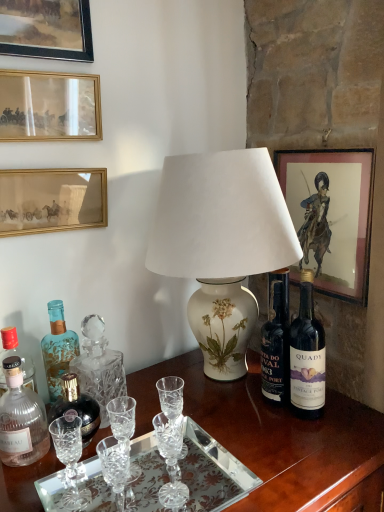
Where is `vacant space in clear glass tray at lower center (from a real-world perspective)`? The image size is (384, 512). vacant space in clear glass tray at lower center (from a real-world perspective) is located at coordinates (164, 479).